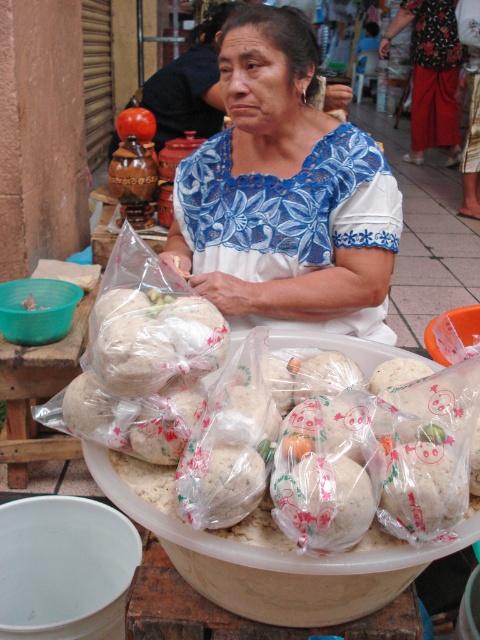
You are setting up a food stall and need to place both the translucent plastic table at lower left and the translucent plastic bowl at lower left. Which object should you place first if you want to ensure there is enough space for both?

You should place the translucent plastic table at lower left first because it is bigger than the translucent plastic bowl at lower left, so placing the larger item first ensures there is enough space left for the smaller one.

You are a customer at the market and want to place your order on the translucent plastic table at lower left. However, there is a translucent plastic bowl at lower left in the way. Can you move the bowl to access the table?

The translucent plastic table at lower left is located below the translucent plastic bowl at lower left, so you can simply move the bowl upwards to access the table.